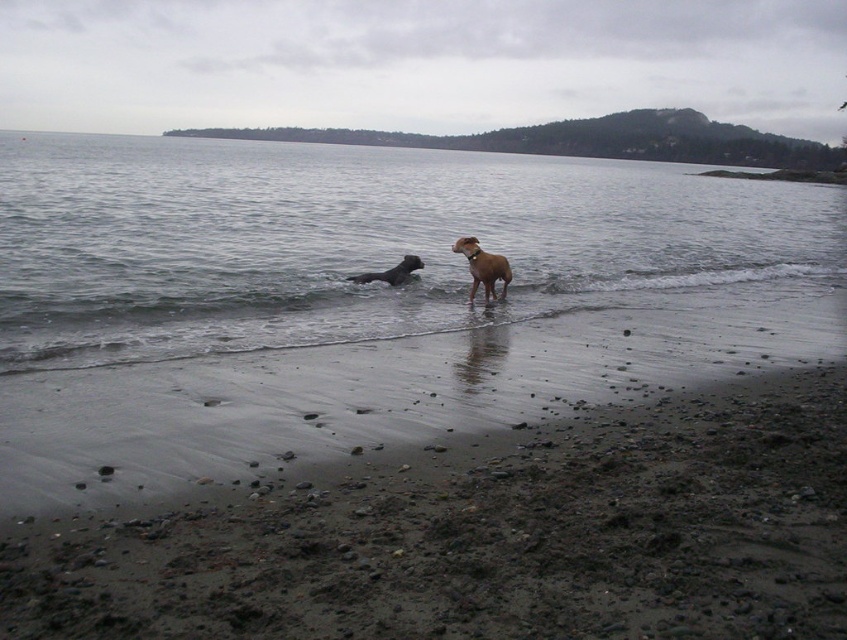
Can you confirm if clear water at center is thinner than brown furry dog at center?

In fact, clear water at center might be wider than brown furry dog at center.

Between clear water at center and brown furry dog at center, which one is positioned higher?

clear water at center is above.

Who is more distant from viewer, (175, 189) or (469, 253)?

Positioned behind is point (175, 189).

Find the location of a particular element. The image size is (847, 640). clear water at center is located at coordinates (363, 241).

Is brown furry dog at center to the left of shiny black dog at center from the viewer's perspective?

Incorrect, brown furry dog at center is not on the left side of shiny black dog at center.

Is point (497, 269) in front of point (410, 280)?

That is True.

Is point (484, 291) positioned in front of point (405, 276)?

Yes, point (484, 291) is closer to viewer.

Locate an element on the screen. This screenshot has width=847, height=640. brown furry dog at center is located at coordinates (483, 268).

Is point (78, 208) behind point (396, 276)?

Yes, point (78, 208) is farther from viewer.

What are the coordinates of `clear water at center` in the screenshot? It's located at (363, 241).

The image size is (847, 640). What do you see at coordinates (363, 241) in the screenshot? I see `clear water at center` at bounding box center [363, 241].

Where is `clear water at center`? The width and height of the screenshot is (847, 640). clear water at center is located at coordinates (363, 241).